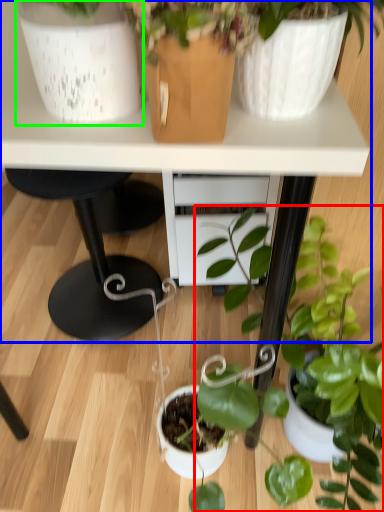
Question: Which object is positioned closest to houseplant (highlighted by a red box)? Select from table (highlighted by a blue box) and flowerpot (highlighted by a green box).

Choices:
 (A) table
 (B) flowerpot

Answer: (A)